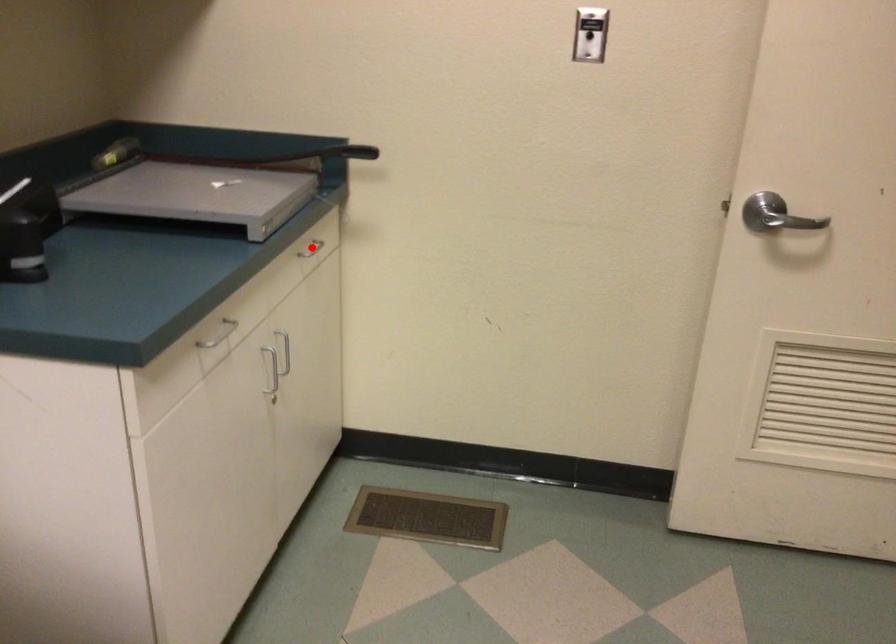
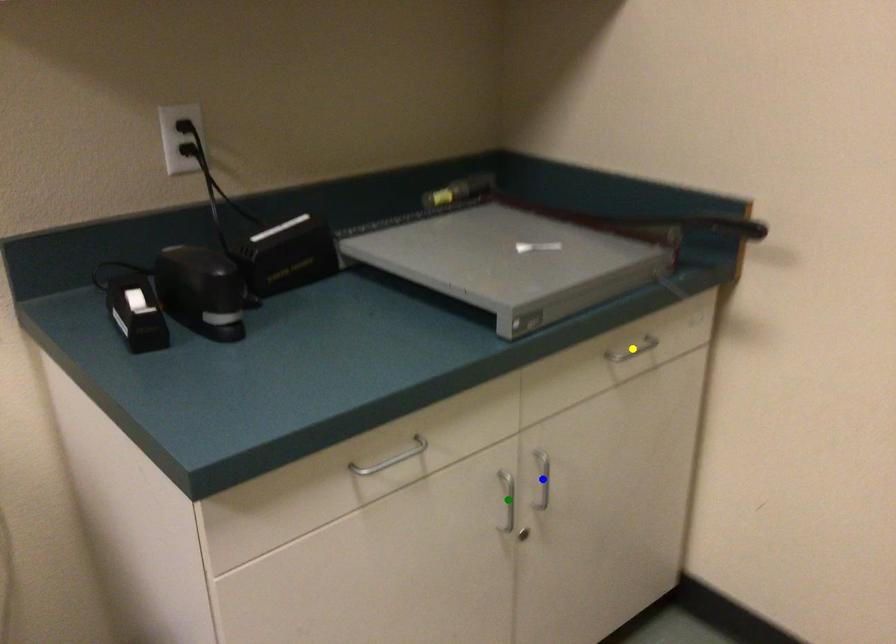
Question: I am providing you with two images of the same scene from different viewpoints. A red point is marked on the first image. You are given multiple points on the second image. Which mark in image 2 goes with the point in image 1?

Choices:
 (A) blue point
 (B) yellow point
 (C) green point

Answer: (B)